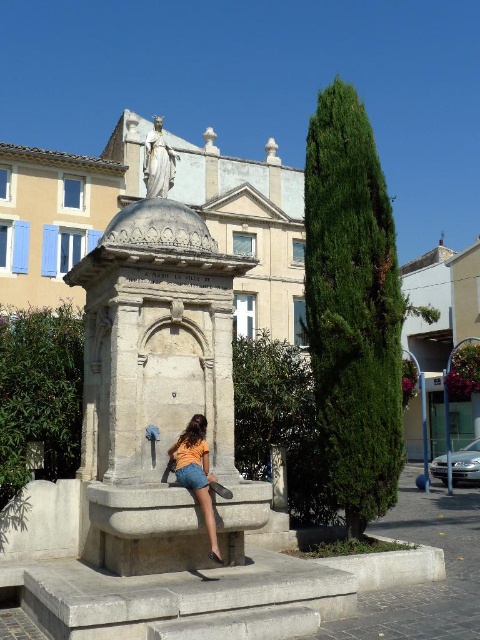
You are a photographer standing in front of the stone fountain. You want to take a photo that includes both the orange cotton shirt at center and the white marble statue at upper center. Based on their positions, which object should appear higher in the photo?

The white marble statue at upper center should appear higher in the photo because the orange cotton shirt at center is located below it.

You are an artist planning to sketch the scene. You want to ensure the orange cotton shirt at center and the white marble statue at upper center are proportionally accurate. Which object should you draw first to maintain proper proportions, considering their relative sizes?

The white marble statue at upper center should be drawn first because it is wider than the orange cotton shirt at center, so establishing its size will help in accurately scaling the smaller shirt afterward.

You are a photographer trying to capture both the orange cotton shirt at center and the white marble statue at upper center in a single frame. Based on their sizes, which object should you focus on first to ensure both are in the frame?

The orange cotton shirt at center has a smaller size compared to the white marble statue at upper center, so you should focus on the white marble statue at upper center first to ensure both are in the frame.